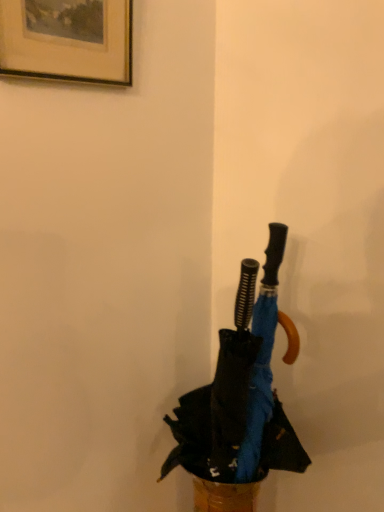
Question: Does blue fabric umbrella at center have a greater height compared to brushed metal picture frame at upper left?

Choices:
 (A) no
 (B) yes

Answer: (B)

Question: From the image's perspective, is blue fabric umbrella at center below brushed metal picture frame at upper left?

Choices:
 (A) yes
 (B) no

Answer: (A)

Question: Is blue fabric umbrella at center not near brushed metal picture frame at upper left?

Choices:
 (A) yes
 (B) no

Answer: (B)

Question: From a real-world perspective, is blue fabric umbrella at center below brushed metal picture frame at upper left?

Choices:
 (A) yes
 (B) no

Answer: (A)

Question: Does blue fabric umbrella at center appear on the left side of brushed metal picture frame at upper left?

Choices:
 (A) yes
 (B) no

Answer: (B)

Question: Is blue fabric umbrella at center bigger than brushed metal picture frame at upper left?

Choices:
 (A) yes
 (B) no

Answer: (A)

Question: Is brushed metal picture frame at upper left in contact with blue fabric umbrella at center?

Choices:
 (A) no
 (B) yes

Answer: (A)

Question: Considering the relative sizes of brushed metal picture frame at upper left and blue fabric umbrella at center in the image provided, is brushed metal picture frame at upper left bigger than blue fabric umbrella at center?

Choices:
 (A) yes
 (B) no

Answer: (B)

Question: Considering the relative sizes of brushed metal picture frame at upper left and blue fabric umbrella at center in the image provided, is brushed metal picture frame at upper left smaller than blue fabric umbrella at center?

Choices:
 (A) no
 (B) yes

Answer: (B)

Question: Can you confirm if brushed metal picture frame at upper left is positioned to the left of blue fabric umbrella at center?

Choices:
 (A) yes
 (B) no

Answer: (A)

Question: Is brushed metal picture frame at upper left taller than blue fabric umbrella at center?

Choices:
 (A) yes
 (B) no

Answer: (B)

Question: Is the position of brushed metal picture frame at upper left less distant than that of blue fabric umbrella at center?

Choices:
 (A) no
 (B) yes

Answer: (B)

Question: Would you say brushed metal picture frame at upper left is to the left or to the right of blue fabric umbrella at center in the picture?

Choices:
 (A) right
 (B) left

Answer: (B)